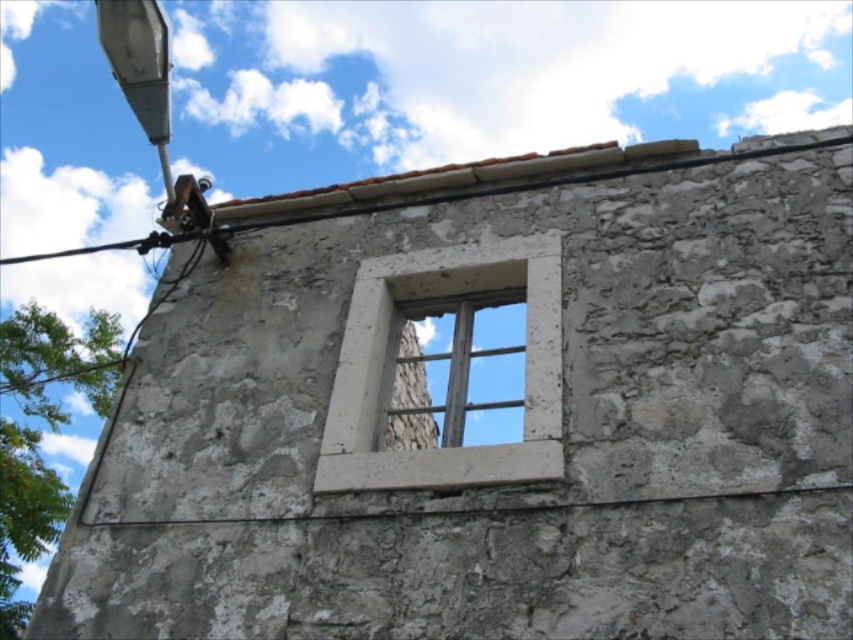
Question: Can you confirm if white stone window frame at center is thinner than wooden window at center?

Choices:
 (A) yes
 (B) no

Answer: (A)

Question: Which object appears closest to the camera in this image?

Choices:
 (A) wooden window at center
 (B) white stone window frame at center

Answer: (A)

Question: Observing the image, what is the correct spatial positioning of white stone window frame at center in reference to wooden window at center?

Choices:
 (A) above
 (B) below

Answer: (A)

Question: Does white stone window frame at center come in front of wooden window at center?

Choices:
 (A) no
 (B) yes

Answer: (A)